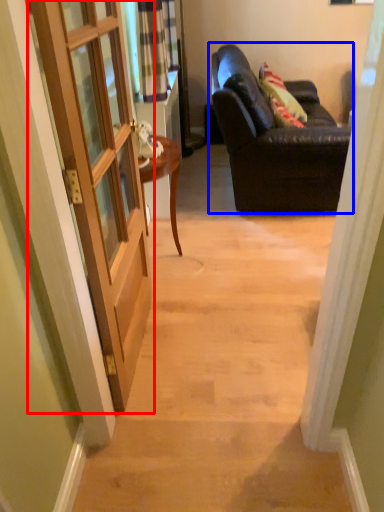
Question: Among these objects, which one is nearest to the camera, door (highlighted by a red box) or studio couch (highlighted by a blue box)?

Choices:
 (A) door
 (B) studio couch

Answer: (A)